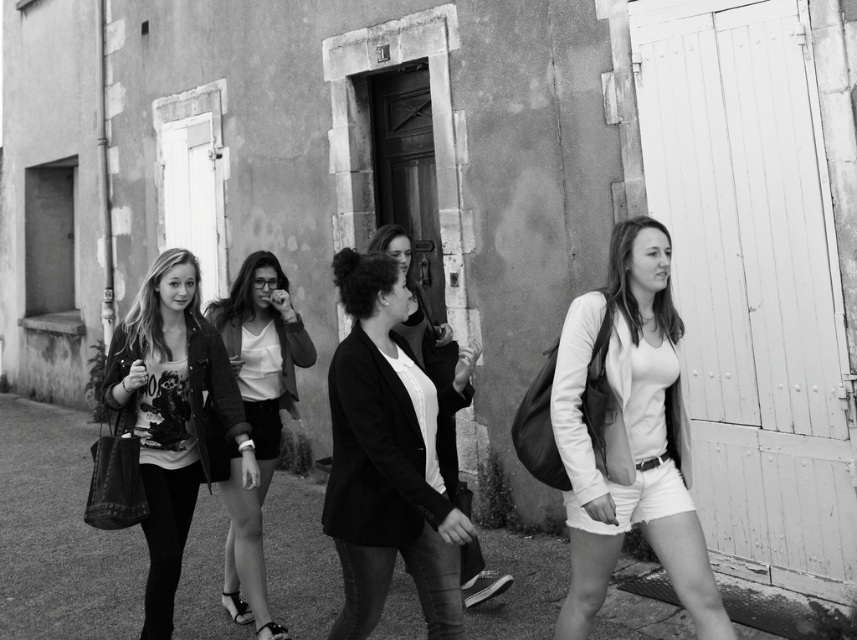
Question: Which point is farther from the camera taking this photo?

Choices:
 (A) (646, 230)
 (B) (436, 552)
 (C) (27, 483)

Answer: (C)

Question: Is white matte shorts at lower right to the right of matte black jacket at left from the viewer's perspective?

Choices:
 (A) no
 (B) yes

Answer: (B)

Question: Can you confirm if smooth concrete pavement at center is positioned above white matte shorts at lower right?

Choices:
 (A) no
 (B) yes

Answer: (A)

Question: Does matte black jacket at center have a smaller size compared to matte black blazer at center?

Choices:
 (A) yes
 (B) no

Answer: (A)

Question: Which point is farther from the camera taking this photo?

Choices:
 (A) (225, 502)
 (B) (67, 620)
 (C) (117, 371)

Answer: (A)

Question: Based on their relative distances, which object is farther from the white matte shorts at lower right?

Choices:
 (A) matte black jacket at left
 (B) smooth concrete pavement at center

Answer: (B)